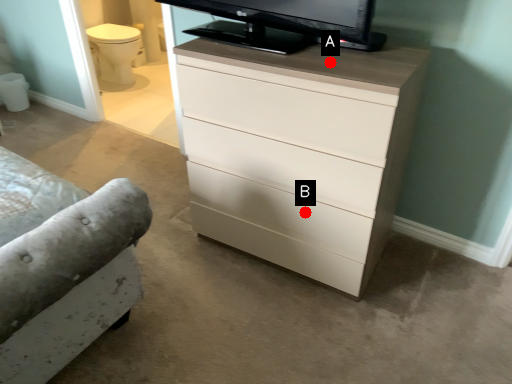
Question: Two points are circled on the image, labeled by A and B beside each circle. Which point is farther from the camera taking this photo?

Choices:
 (A) A is further
 (B) B is further

Answer: (B)